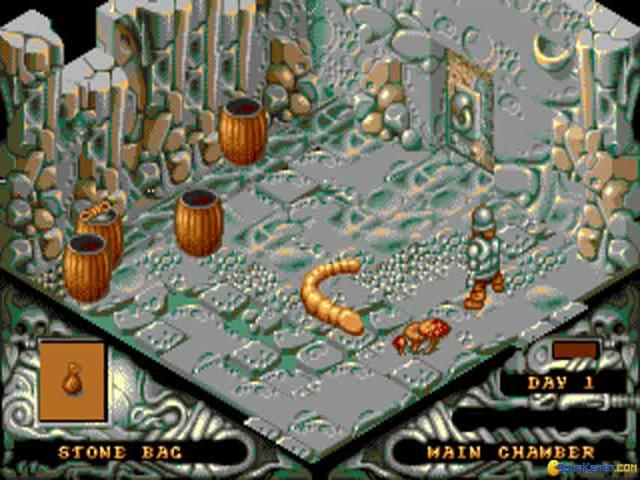
The image size is (640, 480). In order to click on door in this screenshot , I will do `click(481, 126)`.